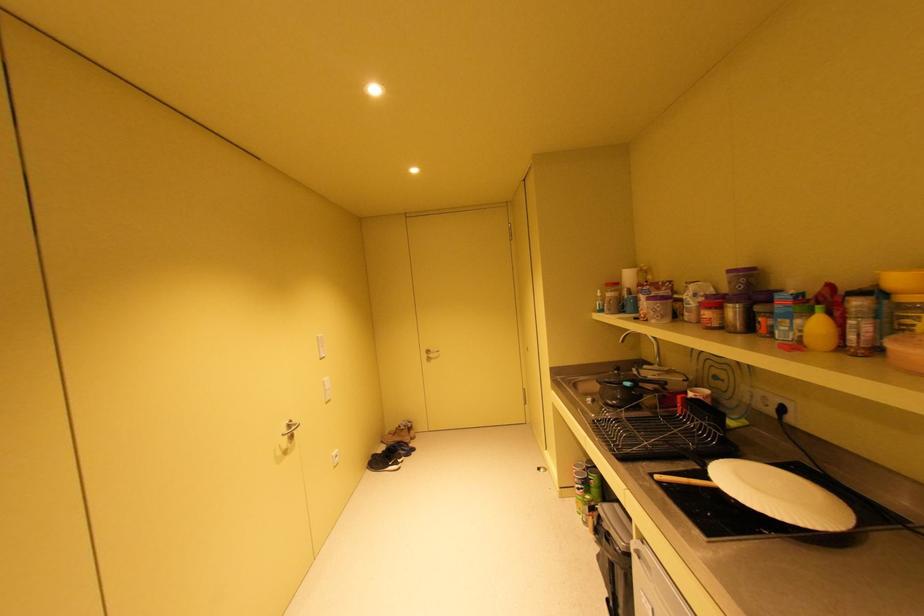
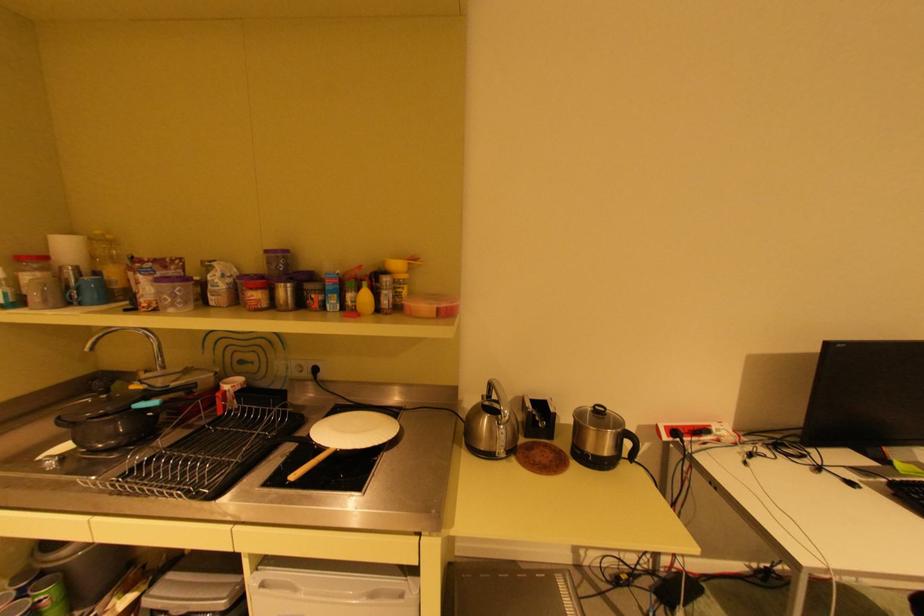
Locate, in the second image, the point that corresponds to the point at 736,272 in the first image.

(274, 251)